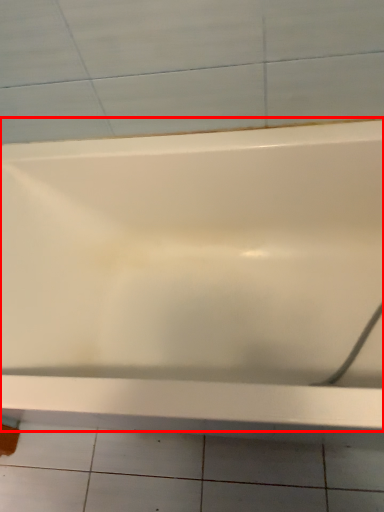
Question: Observing the image, what is the correct spatial positioning of bathtub (annotated by the red box) in reference to ceramic tile?

Choices:
 (A) left
 (B) right

Answer: (B)